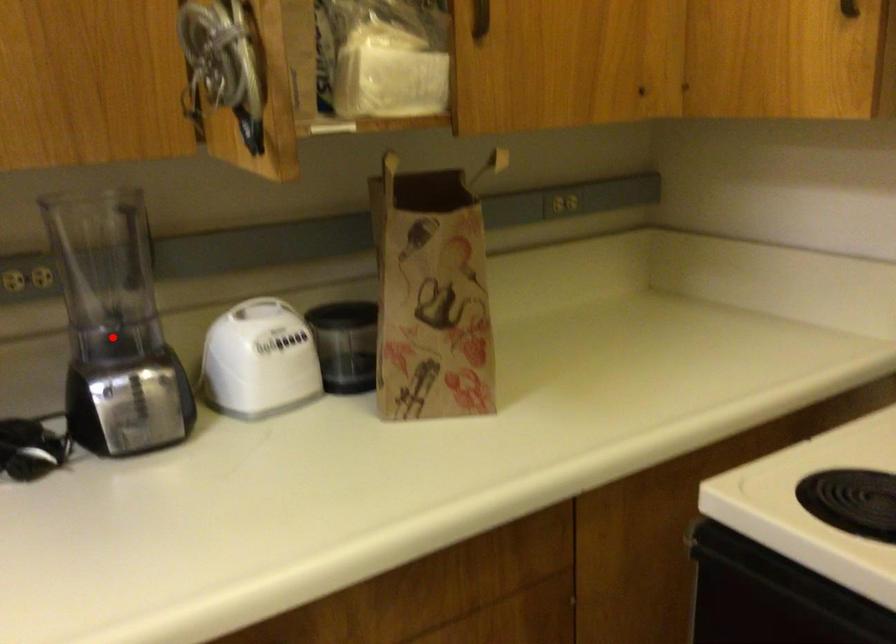
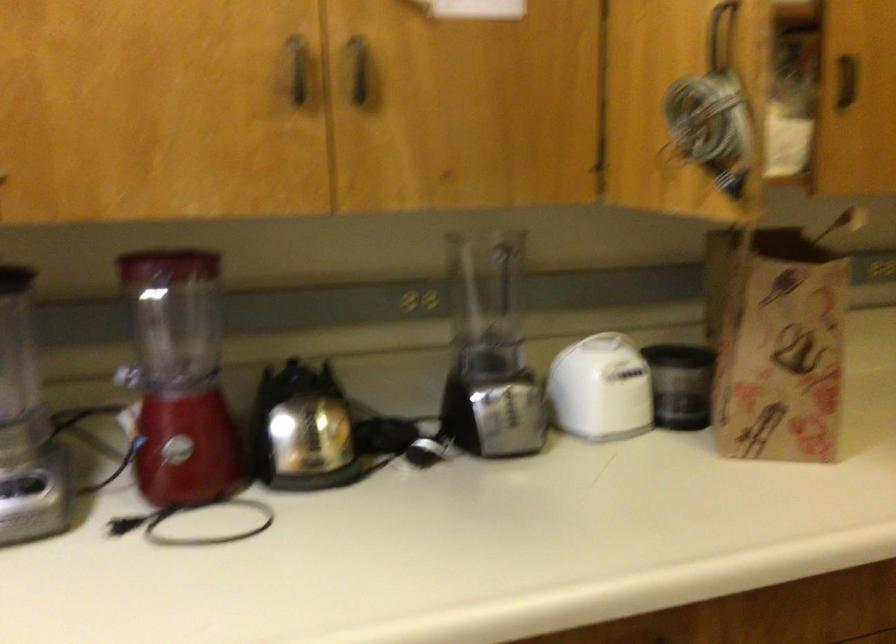
The point at the highlighted location is marked in the first image. Where is the corresponding point in the second image?

(489, 351)